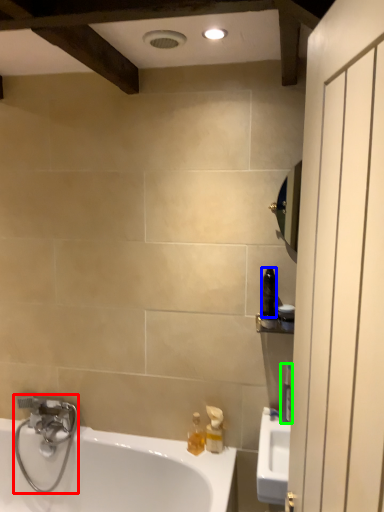
Question: Estimate the real-world distances between objects in this image. Which object is closer to plumbing fixture (highlighted by a red box), toiletry (highlighted by a blue box) or toiletry (highlighted by a green box)?

Choices:
 (A) toiletry
 (B) toiletry

Answer: (B)